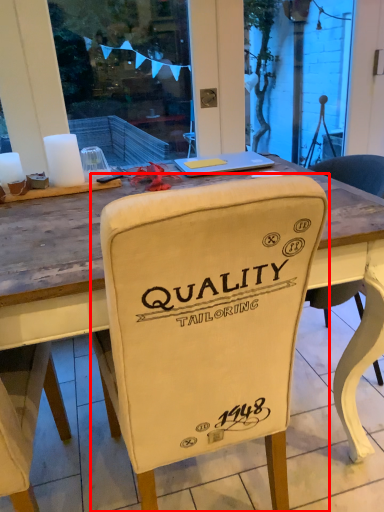
Question: In this image, where is chair (annotated by the red box) located relative to laptop?

Choices:
 (A) right
 (B) left

Answer: (B)